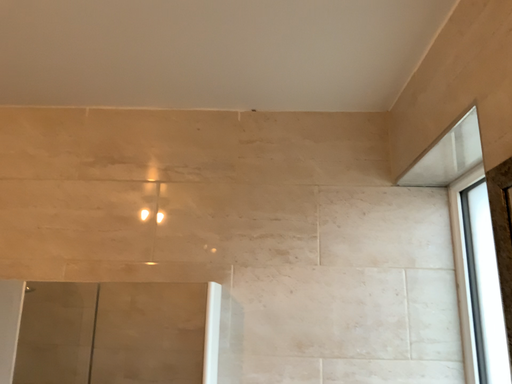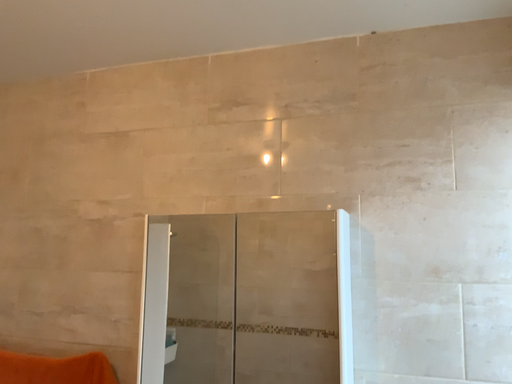
Question: Which way did the camera rotate in the video?

Choices:
 (A) rotated right
 (B) rotated left

Answer: (B)